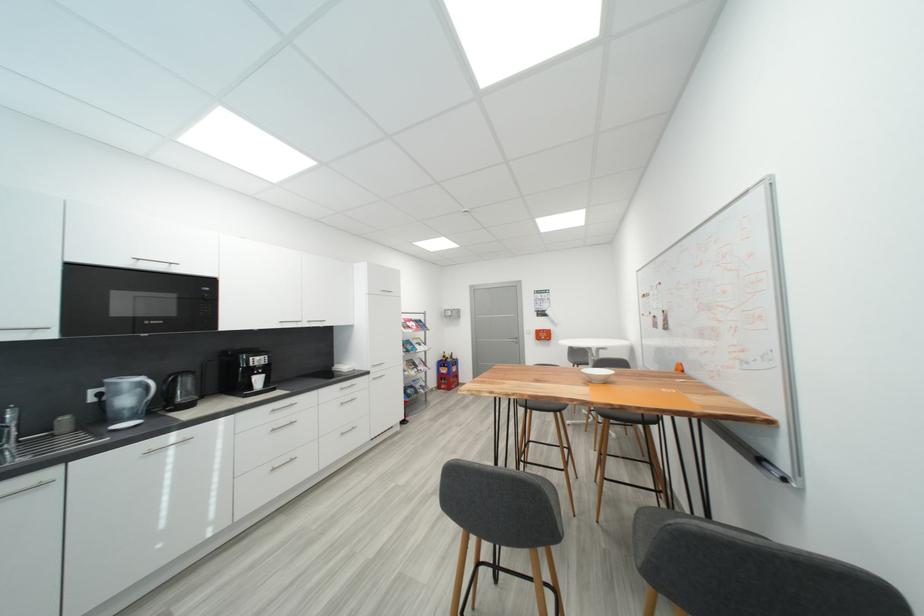
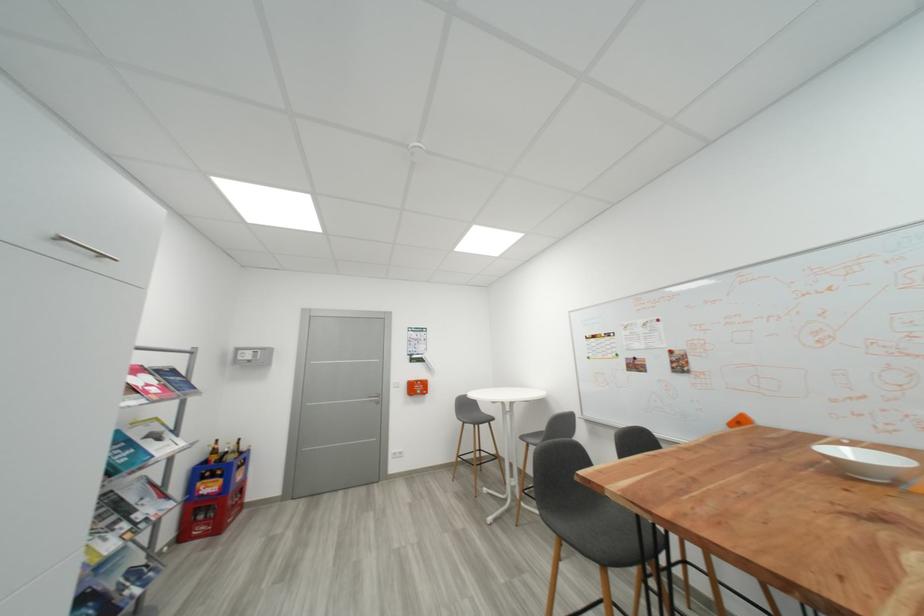
Find the pixel in the second image that matches [445,389] in the first image.

(189, 538)